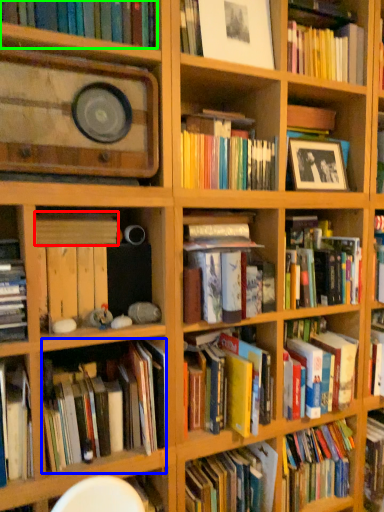
Question: Which object is the farthest from book (highlighted by a red box)? Choose among these: book (highlighted by a blue box) or book (highlighted by a green box).

Choices:
 (A) book
 (B) book

Answer: (B)